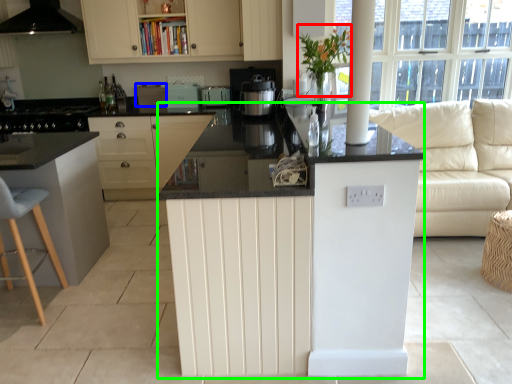
Question: Which is farther away from plant (highlighted by a red box)? appliance (highlighted by a blue box) or counter (highlighted by a green box)?

Choices:
 (A) appliance
 (B) counter

Answer: (A)